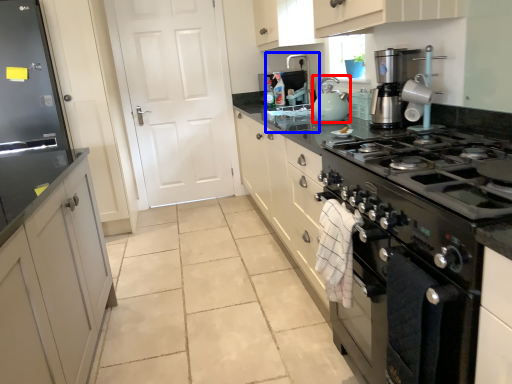
Question: Which object is closer to the camera taking this photo, kitchen appliance (highlighted by a red box) or sink (highlighted by a blue box)?

Choices:
 (A) kitchen appliance
 (B) sink

Answer: (A)